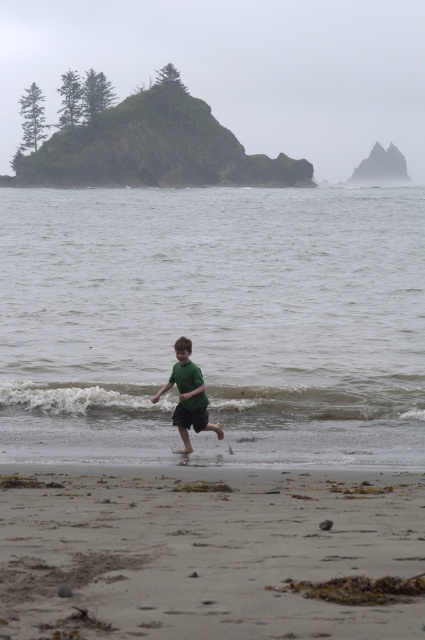
You are standing at the point labeled point (203,381) and want to walk to the point labeled point (164,499). Which direction should you face to walk straight towards your destination?

You should face towards the direction of the camera because point (164,499) is closer to the viewer than point (203,381).